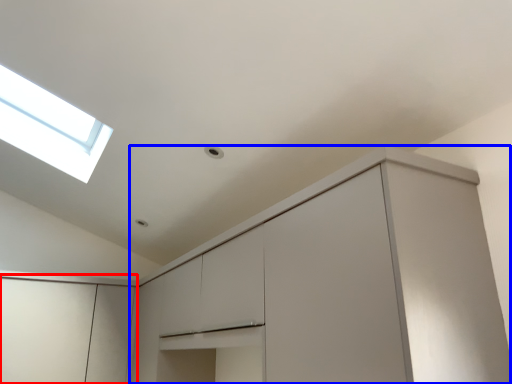
Question: Which of the following is the closest to the observer, cabinetry (highlighted by a red box) or cabinetry (highlighted by a blue box)?

Choices:
 (A) cabinetry
 (B) cabinetry

Answer: (B)